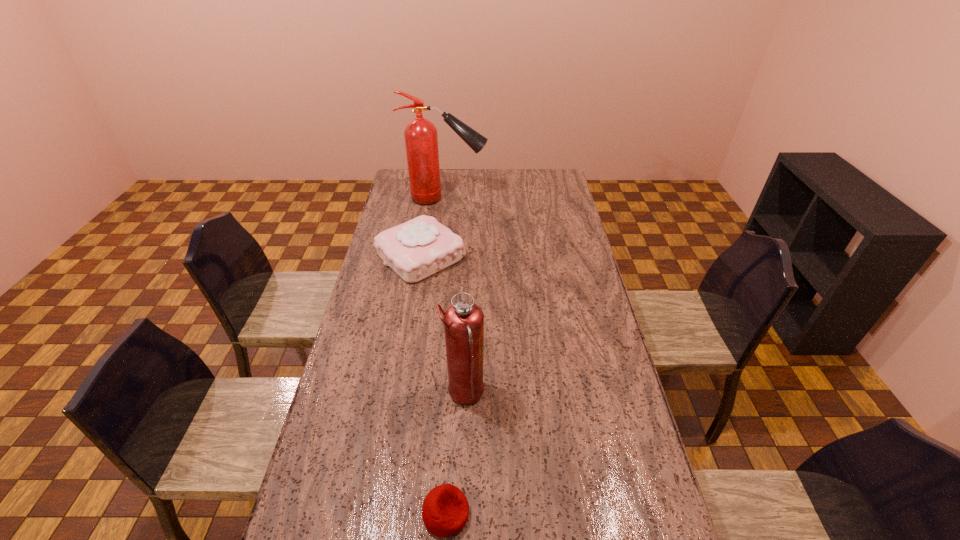
This screenshot has height=540, width=960. Identify the location of the farther fire extinguisher. (421, 140).

Find the location of a particular element. This screenshot has height=540, width=960. the tallest object is located at coordinates (421, 140).

Where is `the second tallest object`? This screenshot has height=540, width=960. the second tallest object is located at coordinates (463, 321).

This screenshot has width=960, height=540. I want to click on the second nearest object, so click(463, 321).

This screenshot has height=540, width=960. I want to click on cake, so click(x=416, y=249).

Where is `the third tallest object`? The height and width of the screenshot is (540, 960). the third tallest object is located at coordinates (416, 249).

Identify the location of the nearest object. (445, 510).

Identify the location of beanbag. The image size is (960, 540). (445, 510).

You are a GUI agent. You are given a task and a screenshot of the screen. Output one action in this format:
    pyautogui.click(x=<x>, y=<y>)
    Task: Click on the vacant region located at the nozzle end of the farthest object
    Image resolution: width=960 pixels, height=540 pixels.
    Given the screenshot: What is the action you would take?
    pyautogui.click(x=508, y=198)

Where is `vacant space located on the side of the nearer fire extinguisher with the label`? The width and height of the screenshot is (960, 540). vacant space located on the side of the nearer fire extinguisher with the label is located at coordinates (541, 394).